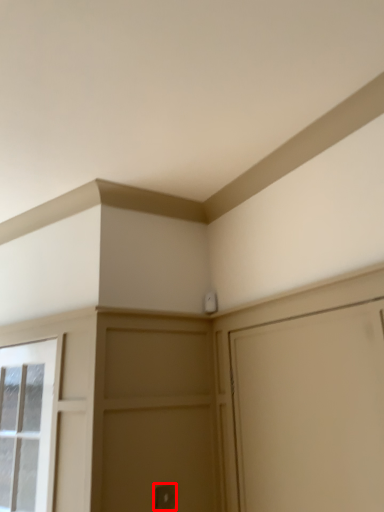
Question: From the image's perspective, what is the correct spatial relationship of door handle (annotated by the red box) in relation to window?

Choices:
 (A) above
 (B) below

Answer: (B)